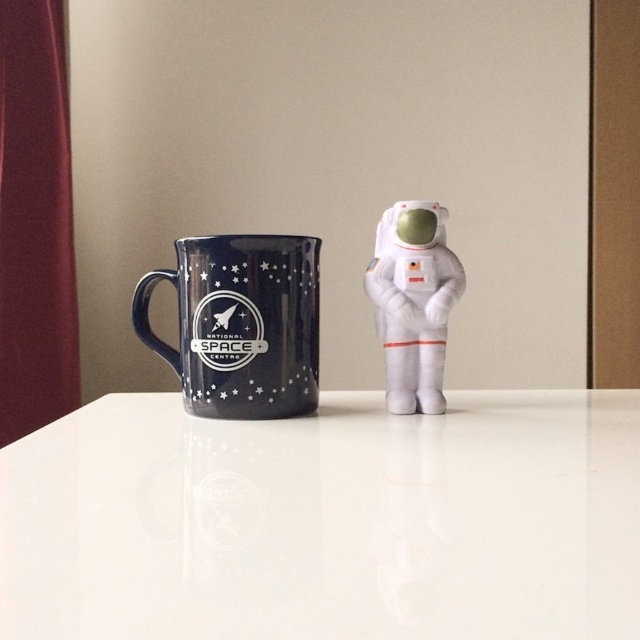
Question: Which point is farther from the camera taking this photo?

Choices:
 (A) (429, 227)
 (B) (314, 237)
 (C) (268, 602)

Answer: (B)

Question: Is white glossy table at center to the left of white plush astronaut at center from the viewer's perspective?

Choices:
 (A) no
 (B) yes

Answer: (B)

Question: Does glossy ceramic mug at upper center have a lesser width compared to white plush astronaut at center?

Choices:
 (A) yes
 (B) no

Answer: (B)

Question: Which point appears closest to the camera in this image?

Choices:
 (A) (410, 288)
 (B) (227, 356)
 (C) (413, 600)

Answer: (C)

Question: Does white glossy table at center appear on the right side of white plush astronaut at center?

Choices:
 (A) no
 (B) yes

Answer: (A)

Question: Which object appears closest to the camera in this image?

Choices:
 (A) white plush astronaut at center
 (B) glossy ceramic mug at upper center

Answer: (B)